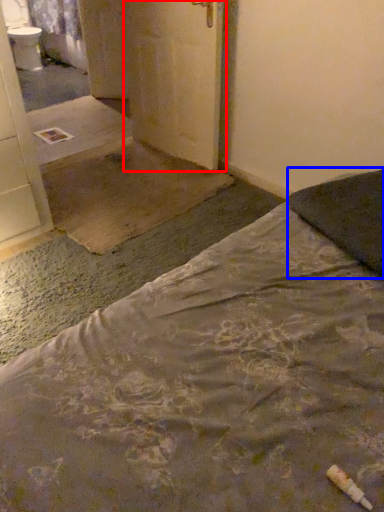
Question: Which of the following is the farthest to the observer, door (highlighted by a red box) or pillow (highlighted by a blue box)?

Choices:
 (A) door
 (B) pillow

Answer: (A)